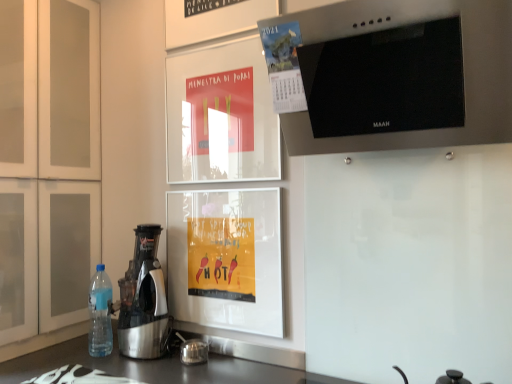
Question: Is white matte cabinet at left to the right of stainless steel range hood at upper right from the viewer's perspective?

Choices:
 (A) yes
 (B) no

Answer: (B)

Question: Considering the relative sizes of white matte cabinet at left and stainless steel range hood at upper right in the image provided, is white matte cabinet at left taller than stainless steel range hood at upper right?

Choices:
 (A) no
 (B) yes

Answer: (B)

Question: Is white matte cabinet at left at the left side of stainless steel range hood at upper right?

Choices:
 (A) yes
 (B) no

Answer: (A)

Question: Considering the relative sizes of white matte cabinet at left and stainless steel range hood at upper right in the image provided, is white matte cabinet at left bigger than stainless steel range hood at upper right?

Choices:
 (A) no
 (B) yes

Answer: (B)

Question: Is white matte cabinet at left next to stainless steel range hood at upper right and touching it?

Choices:
 (A) no
 (B) yes

Answer: (A)

Question: Is metallic calendar at upper center taller or shorter than metallic silver juicer at left?

Choices:
 (A) tall
 (B) short

Answer: (B)

Question: Considering the positions of metallic calendar at upper center and metallic silver juicer at left in the image, is metallic calendar at upper center wider or thinner than metallic silver juicer at left?

Choices:
 (A) thin
 (B) wide

Answer: (A)

Question: From the image's perspective, is metallic calendar at upper center above or below metallic silver juicer at left?

Choices:
 (A) above
 (B) below

Answer: (A)

Question: Is metallic calendar at upper center situated inside metallic silver juicer at left or outside?

Choices:
 (A) outside
 (B) inside

Answer: (A)

Question: Is point (285, 86) positioned closer to the camera than point (61, 127)?

Choices:
 (A) farther
 (B) closer

Answer: (B)

Question: Looking at the image, does metallic calendar at upper center seem bigger or smaller compared to white matte cabinet at left?

Choices:
 (A) big
 (B) small

Answer: (B)

Question: From a real-world perspective, is metallic calendar at upper center physically located above or below white matte cabinet at left?

Choices:
 (A) above
 (B) below

Answer: (A)

Question: From the image's perspective, is metallic calendar at upper center located above or below white matte cabinet at left?

Choices:
 (A) below
 (B) above

Answer: (B)

Question: Is metallic calendar at upper center inside the boundaries of stainless steel range hood at upper right, or outside?

Choices:
 (A) inside
 (B) outside

Answer: (A)

Question: Considering the positions of point (287, 29) and point (482, 140), is point (287, 29) closer or farther from the camera than point (482, 140)?

Choices:
 (A) closer
 (B) farther

Answer: (B)